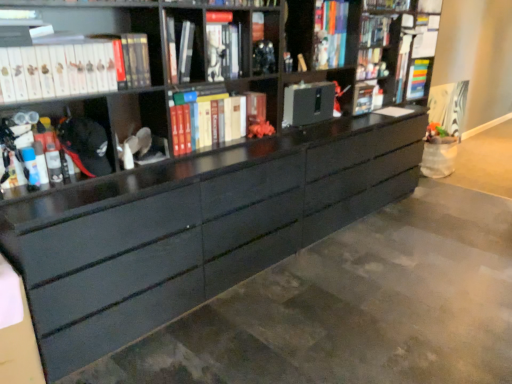
Locate an element on the screen. The height and width of the screenshot is (384, 512). hardcover books at center, acting as the 2th book starting from the right is located at coordinates (215, 118).

The image size is (512, 384). Describe the element at coordinates (215, 118) in the screenshot. I see `hardcover books at center, the fourth book positioned from the front` at that location.

Describe the element at coordinates (16, 144) in the screenshot. I see `matte black marker at left, which is the first book from left to right` at that location.

In order to face matte black marker at left, which is the first book from left to right, should I rotate leftwards or rightwards?

To face it directly, rotate left by 29.012 degrees.

The height and width of the screenshot is (384, 512). In order to click on multicolored plastic book at upper right, which is the fifth book in front-to-back order in this screenshot , I will do `click(419, 78)`.

Identify the location of black matte cabinet at center, marked as the first cabinet in a right-to-left arrangement. (313, 96).

Considering the positions of objects matte black cabinet at center, acting as the second cabinet starting from the right, and white matte book at upper left, which ranks as the 2th book in left-to-right order, in the image provided, who is in front, matte black cabinet at center, acting as the second cabinet starting from the right, or white matte book at upper left, which ranks as the 2th book in left-to-right order,?

white matte book at upper left, which ranks as the 2th book in left-to-right order, is more forward.

From the image's perspective, is matte black cabinet at center, placed as the 2th cabinet when sorted from back to front, located above or below white matte book at upper left, the 1th book positioned from the front?

matte black cabinet at center, placed as the 2th cabinet when sorted from back to front, is situated higher than white matte book at upper left, the 1th book positioned from the front, in the image.

Is white matte book at upper left, which ranks as the 2th book in left-to-right order, facing towards matte black marker at left, the second book viewed from the front?

No, white matte book at upper left, which ranks as the 2th book in left-to-right order, does not turn towards matte black marker at left, the second book viewed from the front.

Considering the sizes of objects white matte book at upper left, positioned as the fourth book in right-to-left order, and matte black marker at left, the second book viewed from the front, in the image provided, who is taller, white matte book at upper left, positioned as the fourth book in right-to-left order, or matte black marker at left, the second book viewed from the front,?

matte black marker at left, the second book viewed from the front.

Is the position of white matte book at upper left, which ranks as the 2th book in left-to-right order, less distant than that of matte black marker at left, acting as the fifth book starting from the right?

Yes, it is in front of matte black marker at left, acting as the fifth book starting from the right.

Is white matte book at upper left, which ranks as the 2th book in left-to-right order, not near matte black marker at left, which is the first book from left to right?

white matte book at upper left, which ranks as the 2th book in left-to-right order, is actually quite close to matte black marker at left, which is the first book from left to right.

Is matte black cabinet at center, acting as the second cabinet starting from the right, in front of or behind matte black marker at left, acting as the fifth book starting from the right, in the image?

In the image, matte black cabinet at center, acting as the second cabinet starting from the right, appears behind matte black marker at left, acting as the fifth book starting from the right.

How different are the orientations of matte black cabinet at center, placed as the 2th cabinet when sorted from back to front, and matte black marker at left, which is the first book from left to right, in degrees?

The facing directions of matte black cabinet at center, placed as the 2th cabinet when sorted from back to front, and matte black marker at left, which is the first book from left to right, are 0.139 degrees apart.

Does point (271, 41) appear closer or farther from the camera than point (3, 147)?

Point (271, 41) is positioned farther from the camera compared to point (3, 147).

Are matte black cabinet at center, acting as the second cabinet starting from the right, and matte black marker at left, arranged as the 4th book when viewed from the back, making contact?

No, matte black cabinet at center, acting as the second cabinet starting from the right, is not with matte black marker at left, arranged as the 4th book when viewed from the back.

From the image's perspective, which object appears higher, hardcover books at center, acting as the 2th book starting from the right, or matte black marker at left, which is the first book from left to right?

hardcover books at center, acting as the 2th book starting from the right, is shown above in the image.

From a real-world perspective, between hardcover books at center, arranged as the fourth book when viewed from the left, and matte black marker at left, arranged as the 4th book when viewed from the back, who is vertically lower?

hardcover books at center, arranged as the fourth book when viewed from the left.

Which is farther from the camera, (196, 120) or (27, 119)?

Point (196, 120)

At what (x,y) coordinates should I click in order to perform the action: click on book that is the 2nd object located behind the matte black marker at left, which is the first book from left to right. Please return your answer as a coordinate pair (x, y). Looking at the image, I should click on (215, 118).

Considering the relative sizes of black matte cabinet at center, marked as the first cabinet in a right-to-left arrangement, and matte black cabinet at center, placed as the 2th cabinet when sorted from back to front, in the image provided, is black matte cabinet at center, marked as the first cabinet in a right-to-left arrangement, bigger than matte black cabinet at center, placed as the 2th cabinet when sorted from back to front,?

Correct, black matte cabinet at center, marked as the first cabinet in a right-to-left arrangement, is larger in size than matte black cabinet at center, placed as the 2th cabinet when sorted from back to front.

How many degrees apart are the facing directions of black matte cabinet at center, which appears as the 1th cabinet when viewed from the back, and matte black cabinet at center, positioned as the 1th cabinet in left-to-right order?

black matte cabinet at center, which appears as the 1th cabinet when viewed from the back, and matte black cabinet at center, positioned as the 1th cabinet in left-to-right order, are facing 1.87 degrees away from each other.

From a real-world perspective, is black matte cabinet at center, acting as the 2th cabinet starting from the left, positioned above or below matte black cabinet at center, placed as the 2th cabinet when sorted from back to front?

Clearly, from a real-world perspective, black matte cabinet at center, acting as the 2th cabinet starting from the left, is below matte black cabinet at center, placed as the 2th cabinet when sorted from back to front.

Does black matte cabinet at center, marked as the first cabinet in a right-to-left arrangement, turn towards matte black cabinet at center, placed as the 2th cabinet when sorted from back to front?

No, black matte cabinet at center, marked as the first cabinet in a right-to-left arrangement, is not turned towards matte black cabinet at center, placed as the 2th cabinet when sorted from back to front.

Identify the location of cabinet that is the 2nd one below the matte black book at upper center, which is the 3th book in front-to-back order (from a real-world perspective). (313, 96).

Between black matte cabinet at center, which ranks as the 2th cabinet in front-to-back order, and matte black book at upper center, the 3th book when ordered from back to front, which one appears on the left side from the viewer's perspective?

Positioned to the left is matte black book at upper center, the 3th book when ordered from back to front.

How many degrees apart are the facing directions of black matte cabinet at center, acting as the 2th cabinet starting from the left, and matte black book at upper center, which is the 3th book in front-to-back order?

There is a 1.75-degree angle between the facing directions of black matte cabinet at center, acting as the 2th cabinet starting from the left, and matte black book at upper center, which is the 3th book in front-to-back order.

In terms of width, does black matte cabinet at center, which ranks as the 2th cabinet in front-to-back order, look wider or thinner when compared to matte black book at upper center, which appears as the third book when viewed from the left?

Considering their sizes, black matte cabinet at center, which ranks as the 2th cabinet in front-to-back order, looks slimmer than matte black book at upper center, which appears as the third book when viewed from the left.

How far apart are matte black book at upper center, the 3th book when ordered from back to front, and black matte cabinet at center, acting as the 2th cabinet starting from the left?

matte black book at upper center, the 3th book when ordered from back to front, and black matte cabinet at center, acting as the 2th cabinet starting from the left, are 38.74 inches apart from each other.

Which is farther from the camera, (174, 54) or (309, 74)?

Positioned behind is point (309, 74).

Is matte black book at upper center, which appears as the third book when viewed from the left, facing away from black matte cabinet at center, which appears as the 1th cabinet when viewed from the back?

No, matte black book at upper center, which appears as the third book when viewed from the left, is not facing the opposite direction of black matte cabinet at center, which appears as the 1th cabinet when viewed from the back.

From the image's perspective, which one is positioned higher, matte black book at upper center, the 3th book when ordered from back to front, or black matte cabinet at center, which ranks as the 2th cabinet in front-to-back order?

matte black book at upper center, the 3th book when ordered from back to front, from the image's perspective.

Where is `cabinet that is the 1st one when counting rightward from the white matte book at upper left, positioned as the fourth book in right-to-left order`? cabinet that is the 1st one when counting rightward from the white matte book at upper left, positioned as the fourth book in right-to-left order is located at coordinates (265, 42).

At what (x,y) coordinates should I click in order to perform the action: click on the 1st book behind the white matte book at upper left, the 1th book positioned from the front, starting your count from the anchor. Please return your answer as a coordinate pair (x, y). The image size is (512, 384). Looking at the image, I should click on (16, 144).

Which object lies nearer to the anchor point black matte cabinet at center, acting as the 2th cabinet starting from the left, matte black cabinet at center, placed as the 2th cabinet when sorted from back to front, or white matte book at upper left, the 1th book positioned from the front?

matte black cabinet at center, placed as the 2th cabinet when sorted from back to front, lies closer to black matte cabinet at center, acting as the 2th cabinet starting from the left, than the other object.

Which object lies nearer to the anchor point matte black cabinet at center, positioned as the 1th cabinet in left-to-right order, matte black book at upper center, which appears as the third book when viewed from the left, or hardcover books at center, acting as the 2th book starting from the right?

hardcover books at center, acting as the 2th book starting from the right.

Estimate the real-world distances between objects in this image. Which object is further from black matte cabinet at center, which ranks as the 2th cabinet in front-to-back order, matte black book at upper center, the 3th book when ordered from back to front, or white matte book at upper left, positioned as the fourth book in right-to-left order?

Among the two, white matte book at upper left, positioned as the fourth book in right-to-left order, is located further to black matte cabinet at center, which ranks as the 2th cabinet in front-to-back order.

Estimate the real-world distances between objects in this image. Which object is closer to matte black book at upper center, the 3th book when ordered from back to front, white matte book at upper left, which ranks as the 2th book in left-to-right order, or matte black cabinet at center, acting as the second cabinet starting from the right?

Based on the image, white matte book at upper left, which ranks as the 2th book in left-to-right order, appears to be nearer to matte black book at upper center, the 3th book when ordered from back to front.

Looking at the image, which one is located further to matte black cabinet at center, the 1th cabinet from the front, hardcover books at center, arranged as the fourth book when viewed from the left, or matte black marker at left, which is the first book from left to right?

matte black marker at left, which is the first book from left to right.

From the image, which object appears to be nearer to matte black cabinet at center, positioned as the 1th cabinet in left-to-right order, white matte book at upper left, the 1th book positioned from the front, or black matte cabinet at center, which ranks as the 2th cabinet in front-to-back order?

black matte cabinet at center, which ranks as the 2th cabinet in front-to-back order, lies closer to matte black cabinet at center, positioned as the 1th cabinet in left-to-right order, than the other object.

Based on their spatial positions, is black matte cabinet at center, acting as the 2th cabinet starting from the left, or matte black marker at left, which is the first book from left to right, closer to matte black cabinet at center, placed as the 2th cabinet when sorted from back to front?

black matte cabinet at center, acting as the 2th cabinet starting from the left, is positioned closer to the anchor matte black cabinet at center, placed as the 2th cabinet when sorted from back to front.

Estimate the real-world distances between objects in this image. Which object is further from black matte cabinet at center, marked as the first cabinet in a right-to-left arrangement, hardcover books at center, arranged as the fourth book when viewed from the left, or matte black book at upper center, which is the 3th book in front-to-back order?

matte black book at upper center, which is the 3th book in front-to-back order, lies further to black matte cabinet at center, marked as the first cabinet in a right-to-left arrangement, than the other object.

Find the location of a particular element. book situated between matte black marker at left, acting as the fifth book starting from the right, and matte black book at upper center, which appears as the third book when viewed from the left, from left to right is located at coordinates [59, 70].

This screenshot has width=512, height=384. What are the coordinates of `book located between matte black book at upper center, the 3th book when ordered from back to front, and matte black cabinet at center, placed as the 2th cabinet when sorted from back to front, in the left-right direction` in the screenshot? It's located at (215, 118).

The image size is (512, 384). In order to click on cabinet located between white matte book at upper left, the 5th book when ordered from back to front, and black matte cabinet at center, which appears as the 1th cabinet when viewed from the back, in the left-right direction in this screenshot , I will do `click(265, 42)`.

The height and width of the screenshot is (384, 512). In order to click on book situated between matte black book at upper center, acting as the 3th book starting from the right, and multicolored plastic book at upper right, the 1th book positioned from the back, from left to right in this screenshot , I will do `click(215, 118)`.